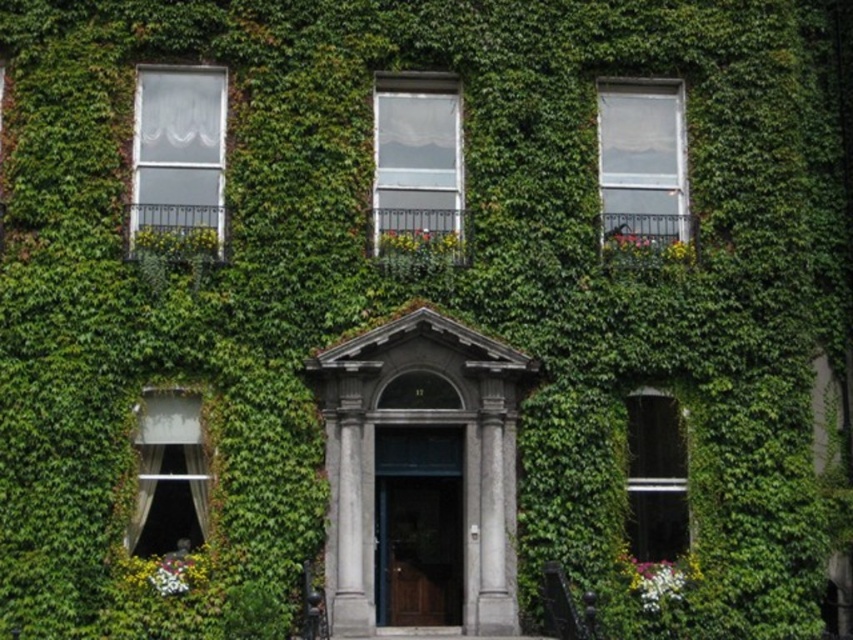
Question: Is white sheer curtain at upper left above clear glass window at center?

Choices:
 (A) yes
 (B) no

Answer: (A)

Question: Is clear glass window at center bigger than clear glass window at upper right?

Choices:
 (A) yes
 (B) no

Answer: (A)

Question: Which is farther from the white sheer curtain at upper left?

Choices:
 (A) clear glass window at right
 (B) white sheer curtain at lower left
 (C) clear glass window at center
 (D) clear glass window at upper right

Answer: (A)

Question: Does clear glass window at center have a greater width compared to white sheer curtain at lower left?

Choices:
 (A) yes
 (B) no

Answer: (B)

Question: Among these points, which one is farthest from the camera?

Choices:
 (A) (676, 541)
 (B) (196, 404)
 (C) (154, 106)
 (D) (431, 120)

Answer: (D)

Question: Which object is positioned closest to the white sheer curtain at upper left?

Choices:
 (A) white sheer curtain at lower left
 (B) clear glass window at right

Answer: (A)